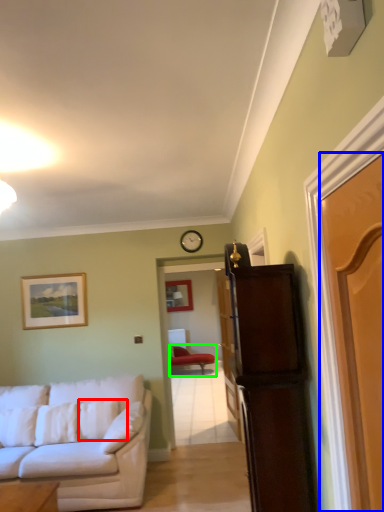
Question: Considering the real-world distances, which object is farthest from pillow (highlighted by a red box)? door (highlighted by a blue box) or chair (highlighted by a green box)?

Choices:
 (A) door
 (B) chair

Answer: (B)